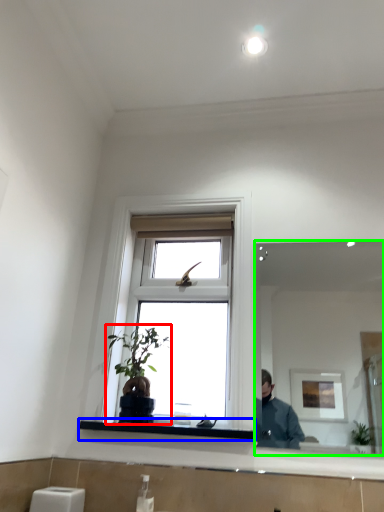
Question: Which object is positioned closest to houseplant (highlighted by a red box)? Select from window sill (highlighted by a blue box) and mirror (highlighted by a green box).

Choices:
 (A) window sill
 (B) mirror

Answer: (A)